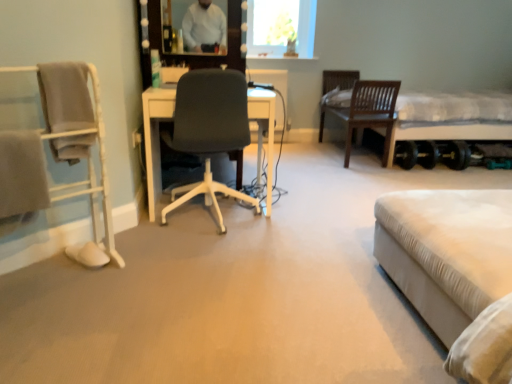
The image size is (512, 384). What are the coordinates of `vacant position to the left of white fabric bed at lower right, positioned as the second bed in right-to-left order` in the screenshot? It's located at (302, 303).